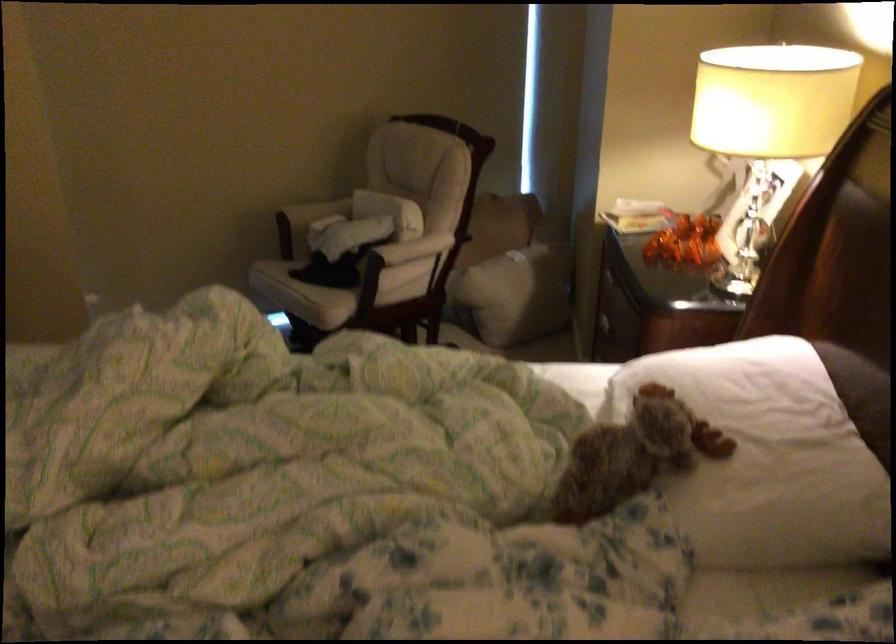
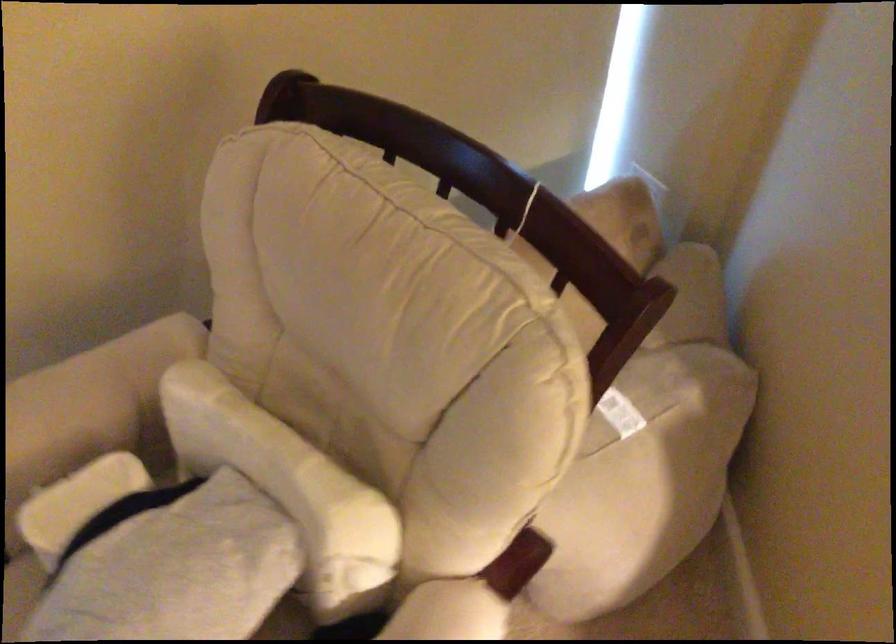
Question: In a continuous first-person perspective shot, in which direction is the camera moving?

Choices:
 (A) Left
 (B) Right
 (C) Forward
 (D) Backward

Answer: (C)